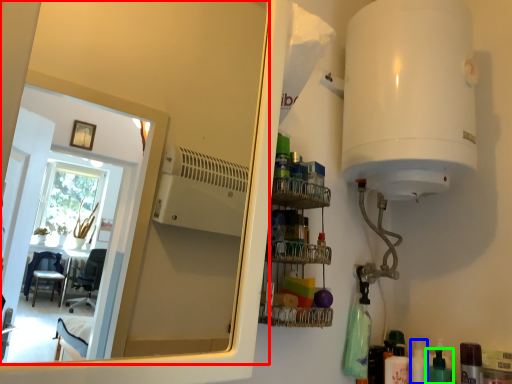
Question: Which object is positioned closest to mirror (highlighted by a red box)? Select from toiletry (highlighted by a blue box) and toiletry (highlighted by a green box).

Choices:
 (A) toiletry
 (B) toiletry

Answer: (A)